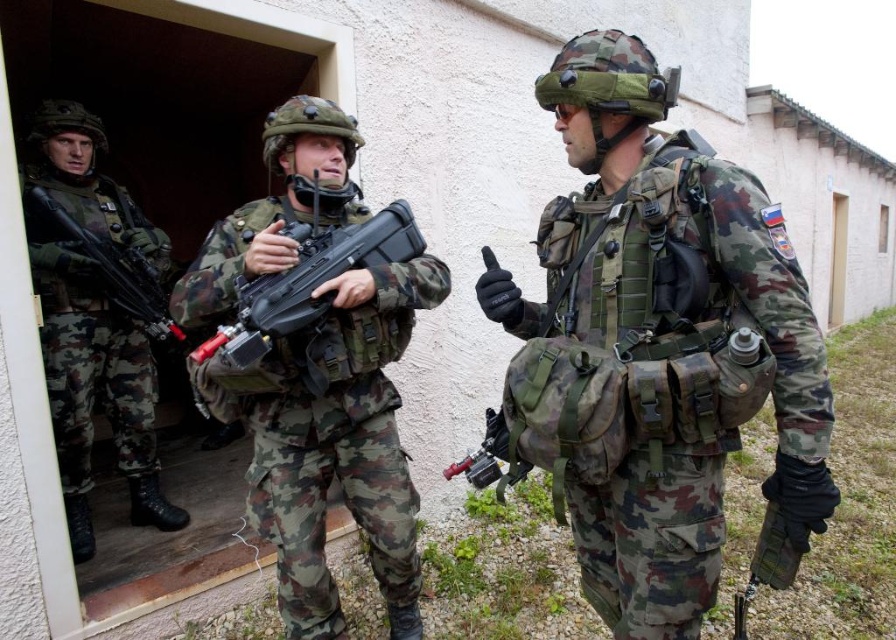
Between camouflage fabric uniform at center and matte black rifle at left, which one has more height?

camouflage fabric uniform at center is taller.

Is point (544, 93) positioned in front of point (82, 227)?

Yes, it is.

You are a GUI agent. You are given a task and a screenshot of the screen. Output one action in this format:
    pyautogui.click(x=<x>, y=<y>)
    Task: Click on the camouflage fabric uniform at center
    This screenshot has width=896, height=640.
    Given the screenshot: What is the action you would take?
    pyautogui.click(x=658, y=349)

Is camouflage fabric rifle at left to the left of matte black rifle at left from the viewer's perspective?

Yes, camouflage fabric rifle at left is to the left of matte black rifle at left.

Does point (126, 452) lie in front of point (148, 280)?

No.

Which is in front, point (71, 131) or point (49, 209)?

Positioned in front is point (49, 209).

Find the location of a particular element. This screenshot has height=640, width=896. camouflage fabric rifle at left is located at coordinates (92, 320).

Can you confirm if camouflage fabric uniform at center is smaller than matte black rifle at center?

No.

Which is above, camouflage fabric uniform at center or matte black rifle at center?

matte black rifle at center

Identify the location of camouflage fabric uniform at center. This screenshot has width=896, height=640. (658, 349).

Find the location of a particular element. The height and width of the screenshot is (640, 896). camouflage fabric uniform at center is located at coordinates (658, 349).